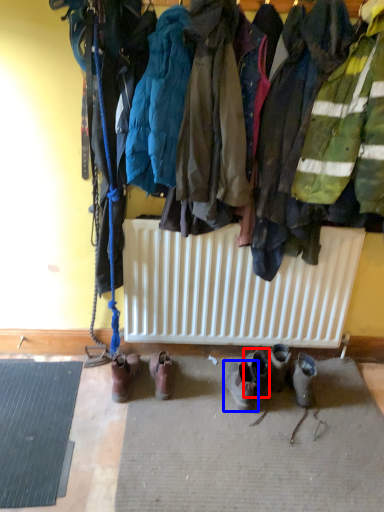
Question: Which point is further to the camera, footwear (highlighted by a red box) or footwear (highlighted by a blue box)?

Choices:
 (A) footwear
 (B) footwear

Answer: (A)